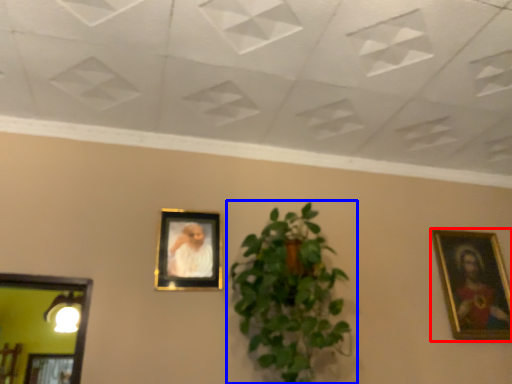
Question: Which of the following is the farthest to the observer, picture frame (highlighted by a red box) or houseplant (highlighted by a blue box)?

Choices:
 (A) picture frame
 (B) houseplant

Answer: (A)